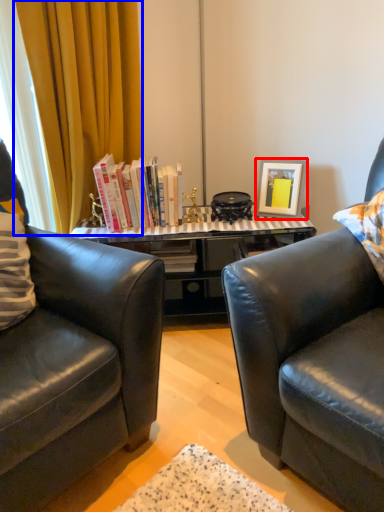
Question: Which object appears farthest to the camera in this image, picture frame (highlighted by a red box) or curtain (highlighted by a blue box)?

Choices:
 (A) picture frame
 (B) curtain

Answer: (A)